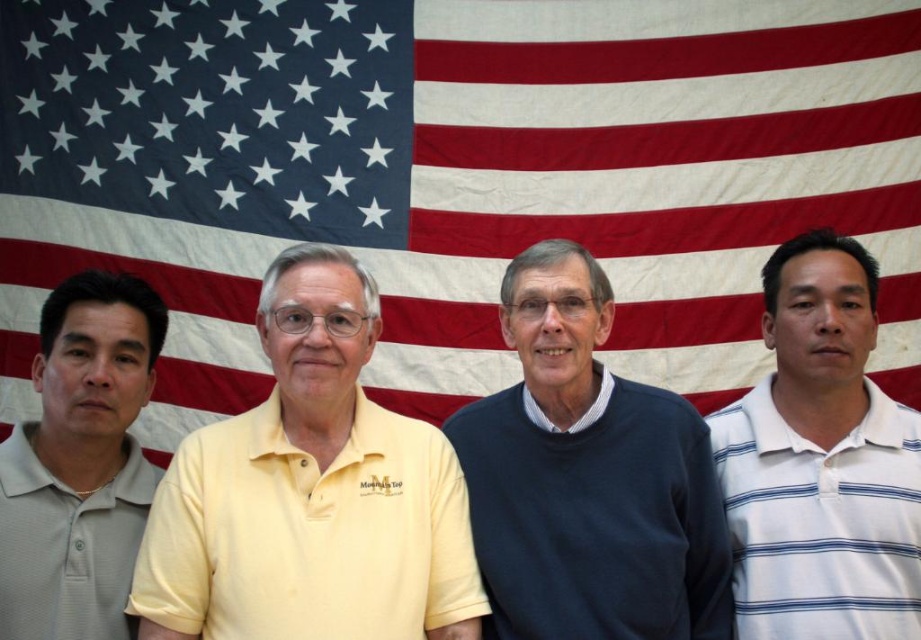
Question: Which point is farther to the camera?

Choices:
 (A) (842, 522)
 (B) (724, 234)
 (C) (348, 296)
 (D) (13, 504)

Answer: (B)

Question: Is yellow cotton polo shirt at center thinner than gray matte polo shirt at left?

Choices:
 (A) yes
 (B) no

Answer: (A)

Question: Is white fabric flag at upper center in front of gray matte polo shirt at left?

Choices:
 (A) no
 (B) yes

Answer: (A)

Question: Among these objects, which one is nearest to the camera?

Choices:
 (A) white striped polo shirt at right
 (B) white fabric flag at upper center
 (C) yellow cotton polo shirt at center

Answer: (C)

Question: Which is farther from the dark blue sweater at center?

Choices:
 (A) gray matte polo shirt at left
 (B) white striped polo shirt at right
 (C) white fabric flag at upper center
 (D) yellow cotton polo shirt at center

Answer: (C)

Question: Is white fabric flag at upper center behind yellow cotton polo shirt at center?

Choices:
 (A) no
 (B) yes

Answer: (B)